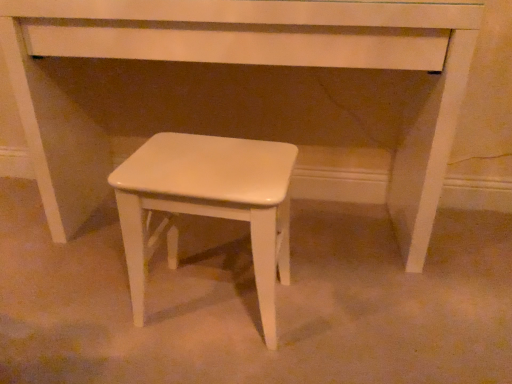
I want to click on empty space that is ontop of white matte stool at center (from a real-world perspective), so click(x=209, y=156).